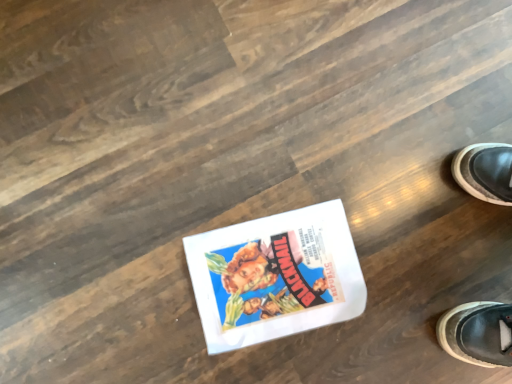
This screenshot has width=512, height=384. Identify the location of vacant area on top of matte paper book at center (from a real-world perspective). (274, 284).